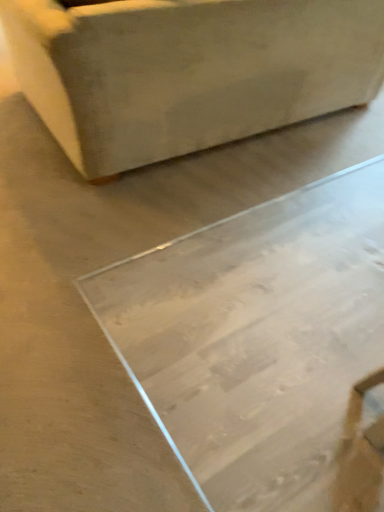
Question: Is transparent glass table at center positioned with its back to matte beige ottoman at upper left?

Choices:
 (A) yes
 (B) no

Answer: (B)

Question: Is transparent glass table at center positioned behind matte beige ottoman at upper left?

Choices:
 (A) yes
 (B) no

Answer: (B)

Question: Does transparent glass table at center have a larger size compared to matte beige ottoman at upper left?

Choices:
 (A) no
 (B) yes

Answer: (A)

Question: Is transparent glass table at center facing towards matte beige ottoman at upper left?

Choices:
 (A) yes
 (B) no

Answer: (B)

Question: From the image's perspective, is transparent glass table at center on top of matte beige ottoman at upper left?

Choices:
 (A) no
 (B) yes

Answer: (A)

Question: From a real-world perspective, is transparent glass table at center on top of matte beige ottoman at upper left?

Choices:
 (A) yes
 (B) no

Answer: (B)

Question: Is matte beige ottoman at upper left placed right next to transparent glass table at center?

Choices:
 (A) no
 (B) yes

Answer: (A)

Question: Is matte beige ottoman at upper left taller than transparent glass table at center?

Choices:
 (A) yes
 (B) no

Answer: (A)

Question: Is matte beige ottoman at upper left shorter than transparent glass table at center?

Choices:
 (A) no
 (B) yes

Answer: (A)

Question: Is matte beige ottoman at upper left closer to camera compared to transparent glass table at center?

Choices:
 (A) yes
 (B) no

Answer: (B)

Question: Does matte beige ottoman at upper left have a greater width compared to transparent glass table at center?

Choices:
 (A) no
 (B) yes

Answer: (A)

Question: Could transparent glass table at center be considered to be inside matte beige ottoman at upper left?

Choices:
 (A) no
 (B) yes

Answer: (A)

Question: Is matte beige ottoman at upper left to the left or to the right of transparent glass table at center in the image?

Choices:
 (A) right
 (B) left

Answer: (B)